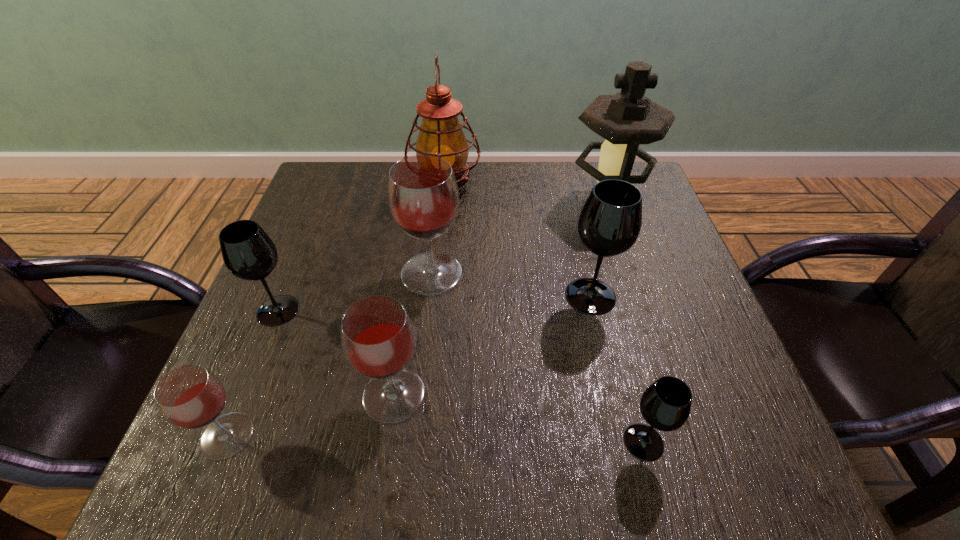
Select which gray wineglass appears as the second closest to the biggest red wineglass. Please provide its 2D coordinates. Your answer should be formatted as a tuple, i.e. [(x, y)], where the tuple contains the x and y coordinates of a point satisfying the conditions above.

[(610, 221)]

At what (x,y) coordinates should I click in order to perform the action: click on vacant point that satisfies the following two spatial constraints: 1. on the front side of the smallest red wineglass; 2. on the right side of the smallest gray wineglass. Please return your answer as a coordinate pair (x, y). The height and width of the screenshot is (540, 960). Looking at the image, I should click on (225, 442).

The image size is (960, 540). Find the location of `vacant point that satisfies the following two spatial constraints: 1. on the back side of the right oil lamp; 2. on the left side of the smallest gray wineglass`. vacant point that satisfies the following two spatial constraints: 1. on the back side of the right oil lamp; 2. on the left side of the smallest gray wineglass is located at coordinates (581, 202).